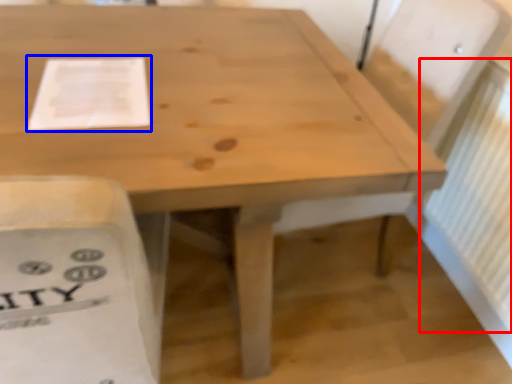
Question: Which of the following is the closest to the observer, radiator (highlighted by a red box) or paper (highlighted by a blue box)?

Choices:
 (A) radiator
 (B) paper

Answer: (B)